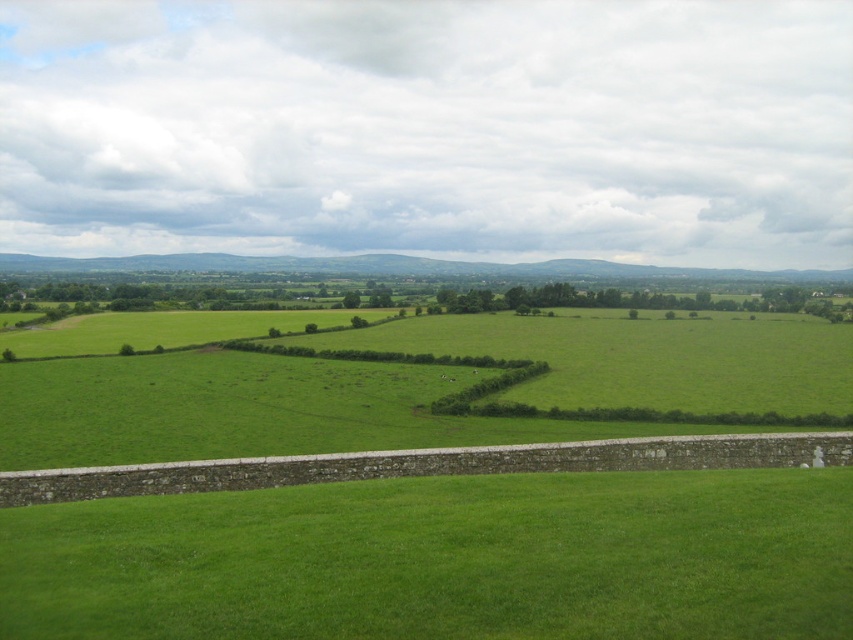
Does green grass at bottom have a smaller size compared to green grass field at center?

Indeed, green grass at bottom has a smaller size compared to green grass field at center.

Which is below, green grass at bottom or green grass field at center?

green grass at bottom

Which is in front, point (165, 529) or point (376, 413)?

Point (165, 529) is in front.

Locate an element on the screen. The width and height of the screenshot is (853, 640). green grass at bottom is located at coordinates (444, 560).

Does green grass at bottom appear under green grassy hedge at center?

Actually, green grass at bottom is above green grassy hedge at center.

Between green grass at bottom and green grassy hedge at center, which one has more height?

green grassy hedge at center

The image size is (853, 640). Identify the location of green grass at bottom. (444, 560).

This screenshot has width=853, height=640. Identify the location of green grass at bottom. (444, 560).

Is green grass field at center taller than green grassy hedge at center?

Correct, green grass field at center is much taller as green grassy hedge at center.

Does point (519, 324) come behind point (509, 384)?

Yes, point (519, 324) is behind point (509, 384).

Locate an element on the screen. green grass field at center is located at coordinates (248, 410).